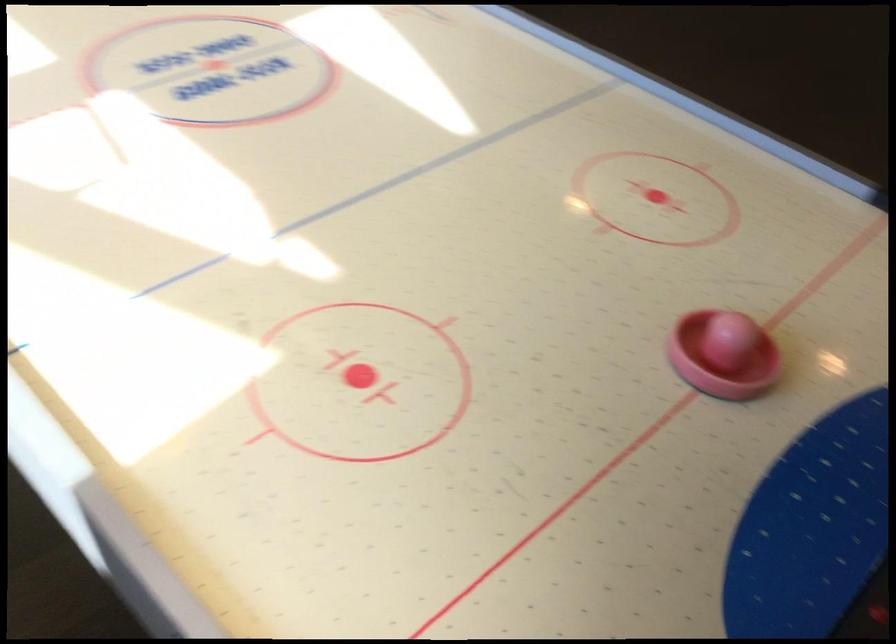
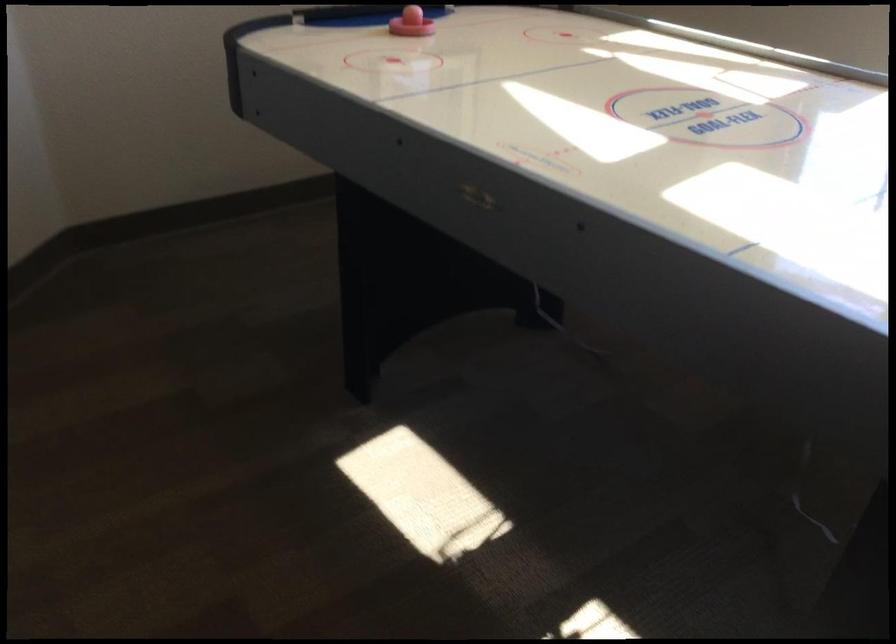
In the second image, find the point that corresponds to [652,304] in the first image.

(410, 23)